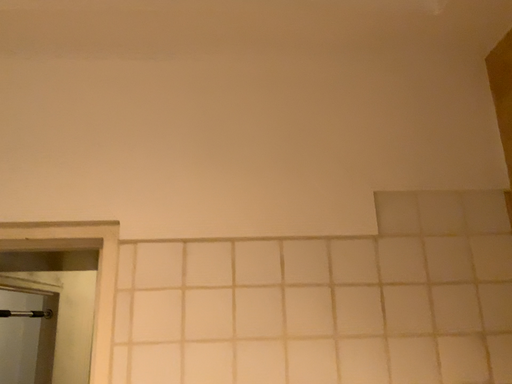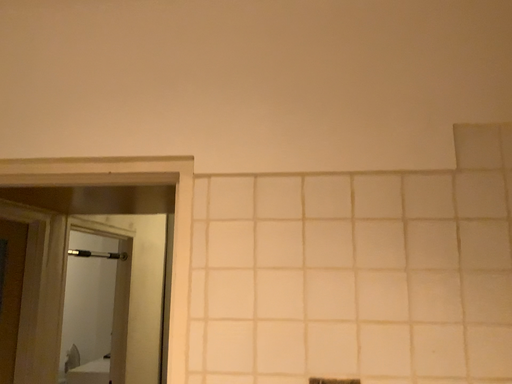
Question: Which way did the camera rotate in the video?

Choices:
 (A) rotated left
 (B) rotated right

Answer: (A)